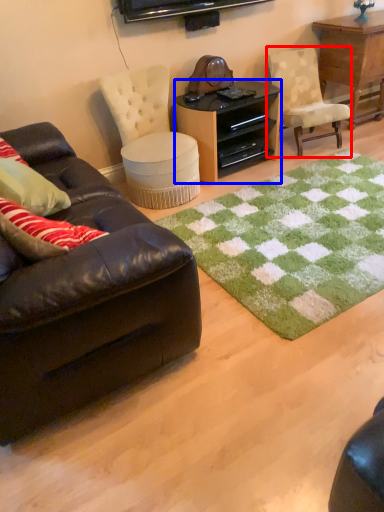
Question: Which point is further to the camera, chair (highlighted by a red box) or desk (highlighted by a blue box)?

Choices:
 (A) chair
 (B) desk

Answer: (A)